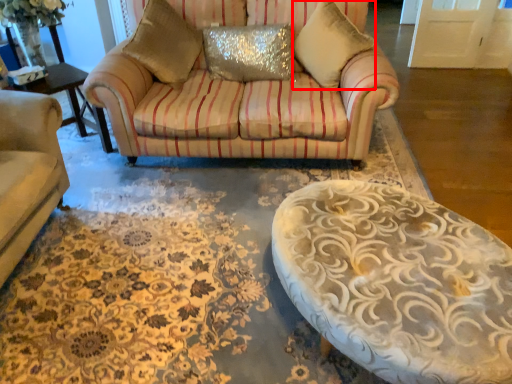
Question: Considering the relative positions of pillow (annotated by the red box) and pillow in the image provided, where is pillow (annotated by the red box) located with respect to the staircase?

Choices:
 (A) left
 (B) right

Answer: (B)